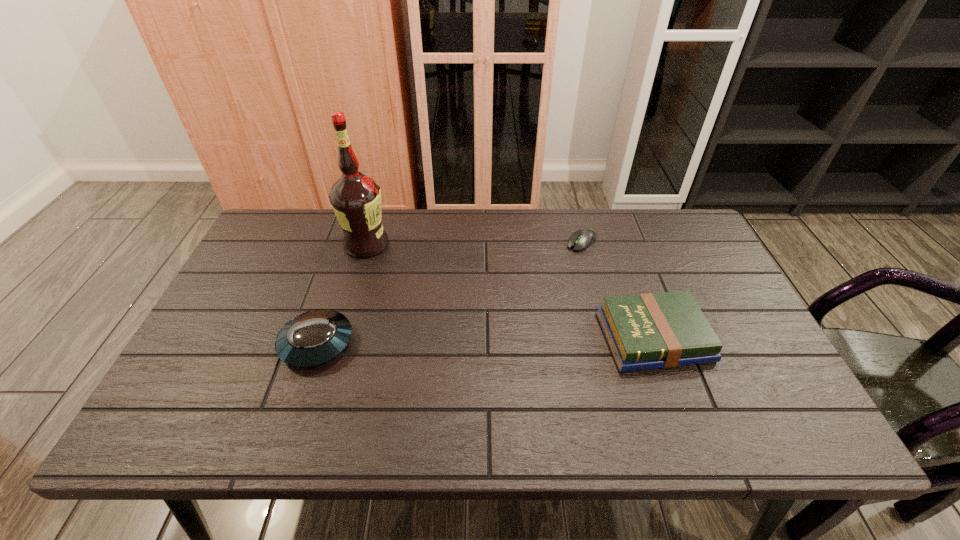
Where is `free space on the desktop that is between the saucer and the book and is positioned on the wheel side of the shortest object`? free space on the desktop that is between the saucer and the book and is positioned on the wheel side of the shortest object is located at coordinates (464, 341).

Locate an element on the screen. This screenshot has width=960, height=540. vacant space on the desktop that is between the saucer and the book and is positioned on the label of the alcohol is located at coordinates click(x=487, y=340).